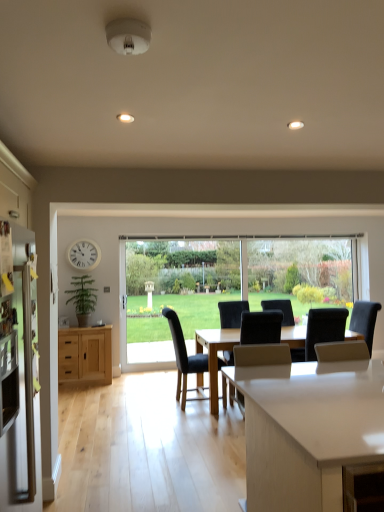
Question: From a real-world perspective, is black leather chair at center, placed as the 1th chair when sorted from left to right, located beneath black fabric chair at center, placed as the first chair when sorted from right to left?

Choices:
 (A) no
 (B) yes

Answer: (B)

Question: Is black leather chair at center, placed as the 1th chair when sorted from left to right, facing towards black fabric chair at center, which ranks as the third chair in left-to-right order?

Choices:
 (A) no
 (B) yes

Answer: (B)

Question: Is black fabric chair at center, placed as the first chair when sorted from right to left, at the back of black leather chair at center, placed as the 1th chair when sorted from left to right?

Choices:
 (A) no
 (B) yes

Answer: (A)

Question: Is black leather chair at center, placed as the 1th chair when sorted from left to right, in front of black fabric chair at center, which ranks as the third chair in left-to-right order?

Choices:
 (A) no
 (B) yes

Answer: (A)

Question: From the image's perspective, is black leather chair at center, which ranks as the third chair in right-to-left order, on black fabric chair at center, placed as the first chair when sorted from right to left?

Choices:
 (A) yes
 (B) no

Answer: (B)

Question: Is point (72, 352) positioned closer to the camera than point (342, 331)?

Choices:
 (A) closer
 (B) farther

Answer: (B)

Question: From the image's perspective, relative to black fabric chair at center, placed as the first chair when sorted from right to left, is natural wood cabinet at left above or below?

Choices:
 (A) below
 (B) above

Answer: (A)

Question: Is natural wood cabinet at left spatially inside black fabric chair at center, which ranks as the third chair in left-to-right order, or outside of it?

Choices:
 (A) inside
 (B) outside

Answer: (B)

Question: In terms of width, does natural wood cabinet at left look wider or thinner when compared to black fabric chair at center, which ranks as the third chair in left-to-right order?

Choices:
 (A) thin
 (B) wide

Answer: (A)

Question: Visually, is white glossy countertop at center positioned to the left or to the right of black fabric chair at center, placed as the first chair when sorted from right to left?

Choices:
 (A) left
 (B) right

Answer: (A)

Question: Is white glossy countertop at center inside the boundaries of black fabric chair at center, which ranks as the third chair in left-to-right order, or outside?

Choices:
 (A) outside
 (B) inside

Answer: (A)

Question: Does point (324, 412) appear closer or farther from the camera than point (314, 330)?

Choices:
 (A) farther
 (B) closer

Answer: (B)

Question: In terms of size, does white glossy countertop at center appear bigger or smaller than black fabric chair at center, placed as the first chair when sorted from right to left?

Choices:
 (A) big
 (B) small

Answer: (A)

Question: Is point (228, 386) closer or farther from the camera than point (16, 426)?

Choices:
 (A) farther
 (B) closer

Answer: (A)

Question: Visually, is dark blue fabric chair at center, the 2th chair from the left, positioned to the left or to the right of satin stainless steel refrigerator at left?

Choices:
 (A) right
 (B) left

Answer: (A)